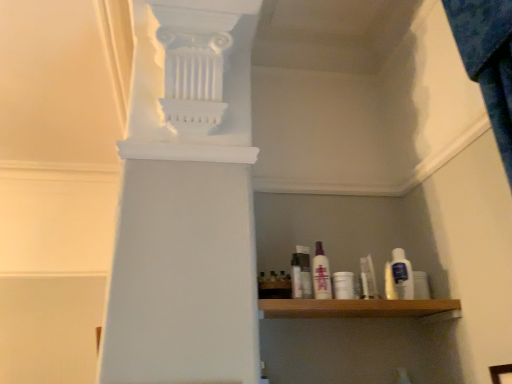
In order to face clear plastic bag at center, the second toiletry when ordered from right to left, should I rotate leftwards or rightwards?

To align with it, rotate right about 14.910°.

You are a GUI agent. You are given a task and a screenshot of the screen. Output one action in this format:
    pyautogui.click(x=<x>, y=<y>)
    Task: Click on the clear plastic bottle at center
    This screenshot has width=512, height=384.
    Given the screenshot: What is the action you would take?
    pyautogui.click(x=301, y=273)

What is the approximate height of clear plastic bottle at center?

The height of clear plastic bottle at center is 6.15 inches.

Locate an element on the screen. The height and width of the screenshot is (384, 512). translucent purple bottle at center, which is the fourth toiletry in right-to-left order is located at coordinates (321, 274).

Considering the sizes of white plastic cup at center, which is the third toiletry from right to left, and translucent purple bottle at center, which is the fourth toiletry in right-to-left order, in the image, is white plastic cup at center, which is the third toiletry from right to left, taller or shorter than translucent purple bottle at center, which is the fourth toiletry in right-to-left order,?

Considering their sizes, white plastic cup at center, which is the third toiletry from right to left, has less height than translucent purple bottle at center, which is the fourth toiletry in right-to-left order.

Can you confirm if white plastic cup at center, which is the 3th toiletry from left to right, is wider than translucent purple bottle at center, which is the fourth toiletry in right-to-left order?

Yes, white plastic cup at center, which is the 3th toiletry from left to right, is wider than translucent purple bottle at center, which is the fourth toiletry in right-to-left order.

Would you say white plastic bottle at center, the fifth toiletry from the right, contains clear plastic bottle at center?

No.

From a real-world perspective, which is physically below, white plastic bottle at center, which ranks as the 1th toiletry in left-to-right order, or clear plastic bottle at center?

white plastic bottle at center, which ranks as the 1th toiletry in left-to-right order, from a real-world perspective.

Considering the sizes of white plastic bottle at center, the fifth toiletry from the right, and clear plastic bottle at center in the image, is white plastic bottle at center, the fifth toiletry from the right, bigger or smaller than clear plastic bottle at center?

white plastic bottle at center, the fifth toiletry from the right, is smaller than clear plastic bottle at center.

Which object is positioned more to the left, white plastic bottle at center, the fifth toiletry from the right, or white plastic bottle at right, which appears as the 1th toiletry when viewed from the right?

white plastic bottle at center, the fifth toiletry from the right, is more to the left.

Is white plastic bottle at center, which ranks as the 1th toiletry in left-to-right order, facing away from white plastic bottle at right, which appears as the 1th toiletry when viewed from the right?

That's not correct — white plastic bottle at center, which ranks as the 1th toiletry in left-to-right order, is not looking away from white plastic bottle at right, which appears as the 1th toiletry when viewed from the right.

Does white plastic bottle at center, which ranks as the 1th toiletry in left-to-right order, come behind white plastic bottle at right, which appears as the 1th toiletry when viewed from the right?

No, the depth of white plastic bottle at center, which ranks as the 1th toiletry in left-to-right order, is less than that of white plastic bottle at right, which appears as the 1th toiletry when viewed from the right.

What are the coordinates of `the 4th toiletry to the left of the white plastic bottle at right, which is the 5th toiletry from left to right, counting from the anchor's position` in the screenshot? It's located at (296, 277).

Is point (347, 277) positioned in front of point (371, 279)?

Yes.

Is the position of white plastic cup at center, which is the third toiletry from right to left, more distant than that of clear plastic bag at center, the second toiletry when ordered from right to left?

No, it is in front of clear plastic bag at center, the second toiletry when ordered from right to left.

Is white plastic cup at center, which is the third toiletry from right to left, touching clear plastic bag at center, the second toiletry when ordered from right to left?

Yes, white plastic cup at center, which is the third toiletry from right to left, is in contact with clear plastic bag at center, the second toiletry when ordered from right to left.

Between white plastic cup at center, which is the 3th toiletry from left to right, and clear plastic bag at center, the second toiletry when ordered from right to left, which one has less height?

With less height is white plastic cup at center, which is the 3th toiletry from left to right.

Is clear plastic bag at center, the second toiletry when ordered from right to left, not inside clear plastic bottle at center?

Yes, clear plastic bag at center, the second toiletry when ordered from right to left, is not within clear plastic bottle at center.

Can you confirm if clear plastic bag at center, positioned as the fourth toiletry in left-to-right order, is positioned to the left of clear plastic bottle at center?

In fact, clear plastic bag at center, positioned as the fourth toiletry in left-to-right order, is to the right of clear plastic bottle at center.

Between clear plastic bag at center, positioned as the fourth toiletry in left-to-right order, and clear plastic bottle at center, which one has more height?

clear plastic bottle at center is taller.

Locate an element on the screen. mouthwash that appears on the left of clear plastic bag at center, the second toiletry when ordered from right to left is located at coordinates (301, 273).

From a real-world perspective, who is located lower, white plastic bottle at center, which ranks as the 1th toiletry in left-to-right order, or white plastic cup at center, which is the third toiletry from right to left?

white plastic cup at center, which is the third toiletry from right to left, is physically lower.

Is white plastic bottle at center, the fifth toiletry from the right, bigger than white plastic cup at center, which is the 3th toiletry from left to right?

Actually, white plastic bottle at center, the fifth toiletry from the right, might be smaller than white plastic cup at center, which is the 3th toiletry from left to right.

Is white plastic bottle at center, which ranks as the 1th toiletry in left-to-right order, positioned before white plastic cup at center, which is the third toiletry from right to left?

Yes, white plastic bottle at center, which ranks as the 1th toiletry in left-to-right order, is in front of white plastic cup at center, which is the third toiletry from right to left.

Do you think white plastic bottle at center, the fifth toiletry from the right, is within white plastic cup at center, which is the third toiletry from right to left, or outside of it?

white plastic bottle at center, the fifth toiletry from the right, exists outside the volume of white plastic cup at center, which is the third toiletry from right to left.

From the image's perspective, which one is positioned lower, clear plastic bag at center, positioned as the fourth toiletry in left-to-right order, or white plastic bottle at center, the fifth toiletry from the right?

clear plastic bag at center, positioned as the fourth toiletry in left-to-right order.

From a real-world perspective, count 1st toiletrys downward from the white plastic bottle at center, which ranks as the 1th toiletry in left-to-right order, and point to it. Please provide its 2D coordinates.

[(368, 278)]

From the translucent purple bottle at center, which is the fourth toiletry in right-to-left order, count 1st toiletrys backward and point to it. Please provide its 2D coordinates.

[(343, 285)]

From the image's perspective, which toiletry is the 1st one below the clear plastic bottle at center? Please provide its 2D coordinates.

[(296, 277)]

Considering their positions, is white plastic bottle at center, the fifth toiletry from the right, positioned further to white plastic cup at center, which is the third toiletry from right to left, than white plastic bottle at right, which is the 5th toiletry from left to right?

white plastic bottle at right, which is the 5th toiletry from left to right, lies further to white plastic cup at center, which is the third toiletry from right to left, than the other object.

When comparing their distances from white plastic cup at center, which is the third toiletry from right to left, does clear plastic bottle at center or translucent purple bottle at center, which is the fourth toiletry in right-to-left order, seem further?

clear plastic bottle at center lies further to white plastic cup at center, which is the third toiletry from right to left, than the other object.

Considering their positions, is clear plastic bag at center, positioned as the fourth toiletry in left-to-right order, positioned further to clear plastic bottle at center than translucent purple bottle at center, placed as the 2th toiletry when sorted from left to right?

Among the two, clear plastic bag at center, positioned as the fourth toiletry in left-to-right order, is located further to clear plastic bottle at center.

Estimate the real-world distances between objects in this image. Which object is closer to translucent purple bottle at center, which is the fourth toiletry in right-to-left order, white plastic cup at center, which is the 3th toiletry from left to right, or clear plastic bottle at center?

Based on the image, clear plastic bottle at center appears to be nearer to translucent purple bottle at center, which is the fourth toiletry in right-to-left order.

Estimate the real-world distances between objects in this image. Which object is further from white plastic bottle at center, the fifth toiletry from the right, white plastic bottle at right, which appears as the 1th toiletry when viewed from the right, or translucent purple bottle at center, which is the fourth toiletry in right-to-left order?

white plastic bottle at right, which appears as the 1th toiletry when viewed from the right, lies further to white plastic bottle at center, the fifth toiletry from the right, than the other object.

Consider the image. Based on their spatial positions, is white plastic bottle at center, which ranks as the 1th toiletry in left-to-right order, or white plastic bottle at right, which is the 5th toiletry from left to right, closer to clear plastic bag at center, positioned as the fourth toiletry in left-to-right order?

white plastic bottle at right, which is the 5th toiletry from left to right.

Looking at the image, which one is located closer to white plastic bottle at center, the fifth toiletry from the right, translucent purple bottle at center, placed as the 2th toiletry when sorted from left to right, or clear plastic bag at center, the second toiletry when ordered from right to left?

translucent purple bottle at center, placed as the 2th toiletry when sorted from left to right, is closer to white plastic bottle at center, the fifth toiletry from the right.

When comparing their distances from clear plastic bag at center, positioned as the fourth toiletry in left-to-right order, does clear plastic bottle at center or white plastic cup at center, which is the 3th toiletry from left to right, seem closer?

white plastic cup at center, which is the 3th toiletry from left to right, is closer to clear plastic bag at center, positioned as the fourth toiletry in left-to-right order.

Locate an element on the screen. The width and height of the screenshot is (512, 384). toiletry between clear plastic bottle at center and white plastic cup at center, which is the 3th toiletry from left to right, in the horizontal direction is located at coordinates (321, 274).

In order to click on mouthwash between white plastic bottle at center, which ranks as the 1th toiletry in left-to-right order, and clear plastic bag at center, positioned as the fourth toiletry in left-to-right order in this screenshot , I will do `click(301, 273)`.

Identify the location of toiletry between white plastic bottle at center, which ranks as the 1th toiletry in left-to-right order, and white plastic cup at center, which is the third toiletry from right to left, from left to right. (321, 274).

You are a GUI agent. You are given a task and a screenshot of the screen. Output one action in this format:
    pyautogui.click(x=<x>, y=<y>)
    Task: Click on the mouthwash located between white plastic bottle at center, which ranks as the 1th toiletry in left-to-right order, and translucent purple bottle at center, placed as the 2th toiletry when sorted from left to right, in the left-right direction
    This screenshot has height=384, width=512.
    Given the screenshot: What is the action you would take?
    pyautogui.click(x=301, y=273)